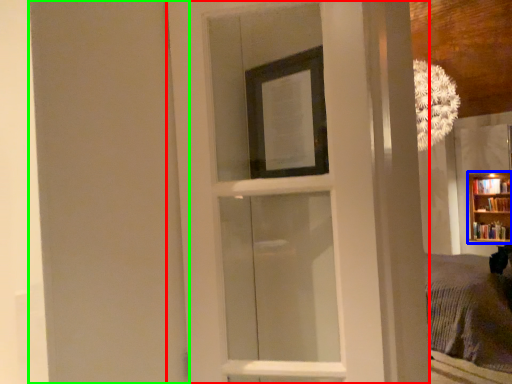
Question: Which is nearer to the door (highlighted by a red box)? bookcase (highlighted by a blue box) or screen door (highlighted by a green box).

Choices:
 (A) bookcase
 (B) screen door

Answer: (B)